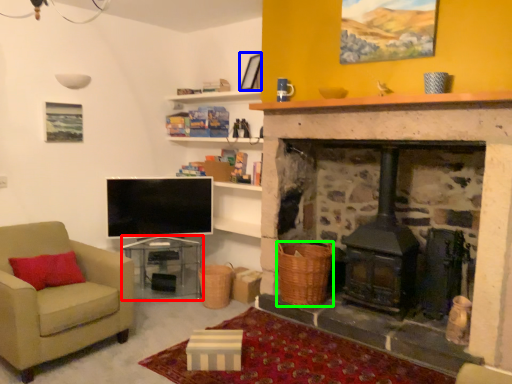
Question: Which object is positioned farthest from table (highlighted by a red box)? Select from picture frame (highlighted by a blue box) and basket (highlighted by a green box).

Choices:
 (A) picture frame
 (B) basket

Answer: (A)